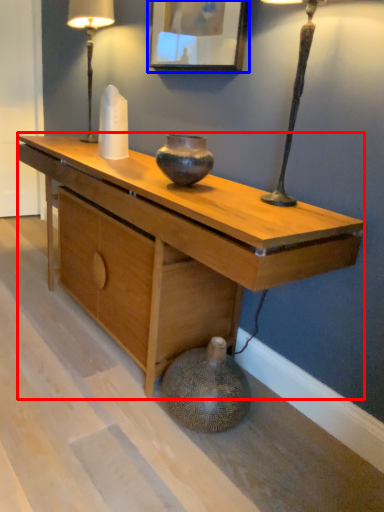
Question: Which object is closer to the camera taking this photo, desk (highlighted by a red box) or picture frame (highlighted by a blue box)?

Choices:
 (A) desk
 (B) picture frame

Answer: (A)